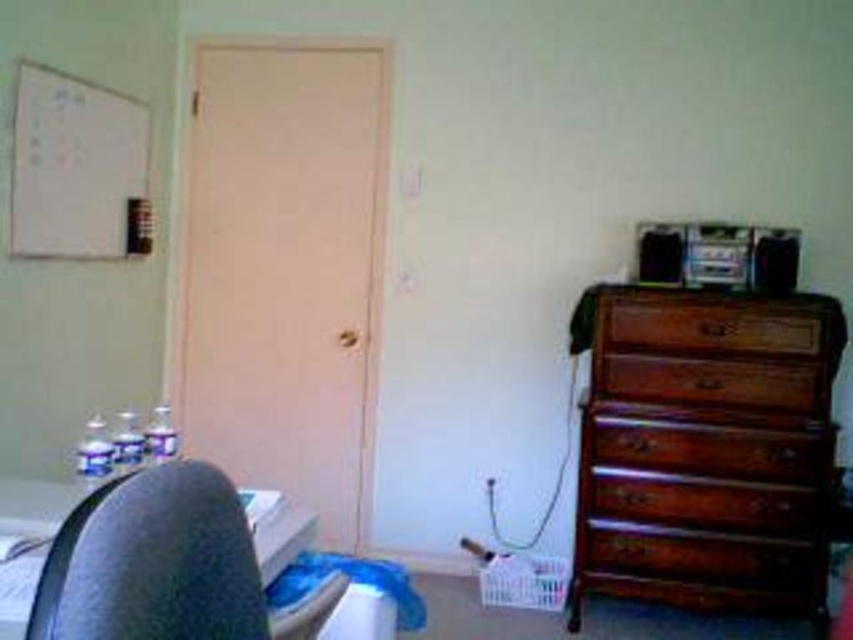
Question: Does wooden dresser at right appear on the left side of brown wood drawer at right?

Choices:
 (A) no
 (B) yes

Answer: (B)

Question: Can you confirm if brown wood drawer at right is positioned to the left of wooden drawer at right?

Choices:
 (A) yes
 (B) no

Answer: (A)

Question: Does wooden dresser at right lie behind brown wood drawer at right?

Choices:
 (A) no
 (B) yes

Answer: (A)

Question: Among these objects, which one is farthest from the camera?

Choices:
 (A) brown wood drawer at right
 (B) wooden drawer at right
 (C) matte black swivel chair at left

Answer: (B)

Question: Based on their relative distances, which object is farther from the wooden drawer at right?

Choices:
 (A) brown wood drawer at right
 (B) wooden dresser at right

Answer: (B)

Question: Which of these objects is positioned farthest from the matte black swivel chair at left?

Choices:
 (A) wooden dresser at right
 (B) wooden drawer at right

Answer: (B)